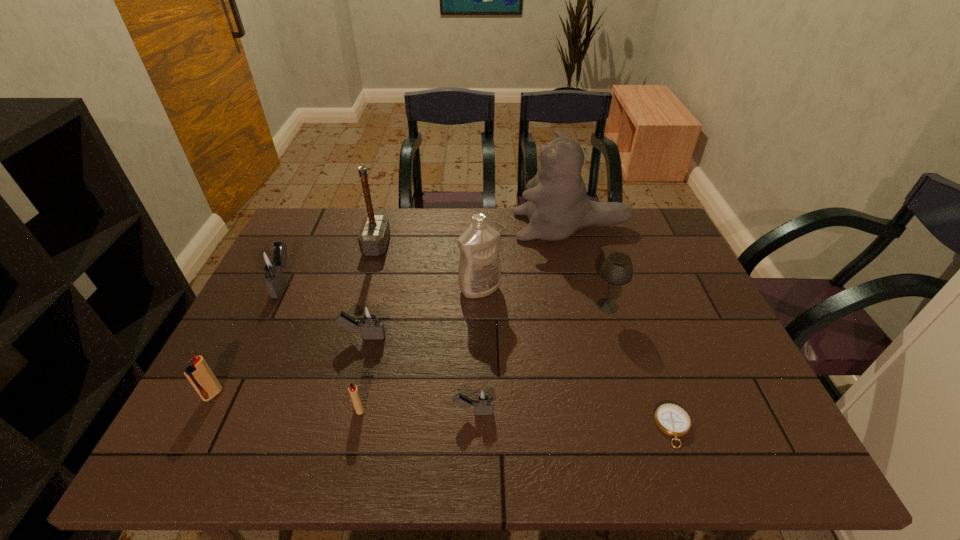
Locate an element on the screen. free space between the compass and the cat is located at coordinates (622, 327).

The height and width of the screenshot is (540, 960). Identify the location of free space between the shortest object and the cat. (622, 327).

Find the location of a particular element. free space between the second gray igniter from right to left and the shortest object is located at coordinates (518, 382).

Find the location of a particular element. The image size is (960, 540). free space that is in between the white detergent and the rightmost igniter is located at coordinates (476, 350).

At what (x,y) coordinates should I click in order to perform the action: click on vacant area that lies between the green cat and the rightmost igniter. Please return your answer as a coordinate pair (x, y). Looking at the image, I should click on (522, 319).

At what (x,y) coordinates should I click in order to perform the action: click on free space between the second biggest gray igniter and the tallest igniter. Please return your answer as a coordinate pair (x, y). Looking at the image, I should click on (324, 309).

The image size is (960, 540). I want to click on vacant area that lies between the fifth nearest object and the tallest igniter, so click(324, 309).

Select which object is the seventh closest to the smaller red igniter. Please provide its 2D coordinates. Your answer should be formatted as a tuple, i.e. [(x, y)], where the tuple contains the x and y coordinates of a point satisfying the conditions above.

[(617, 269)]

Point out which object is positioned as the seventh nearest to the farthest gray igniter. Please provide its 2D coordinates. Your answer should be formatted as a tuple, i.e. [(x, y)], where the tuple contains the x and y coordinates of a point satisfying the conditions above.

[(558, 206)]

Select which igniter is the fifth closest to the white detergent. Please provide its 2D coordinates. Your answer should be formatted as a tuple, i.e. [(x, y)], where the tuple contains the x and y coordinates of a point satisfying the conditions above.

[(199, 374)]